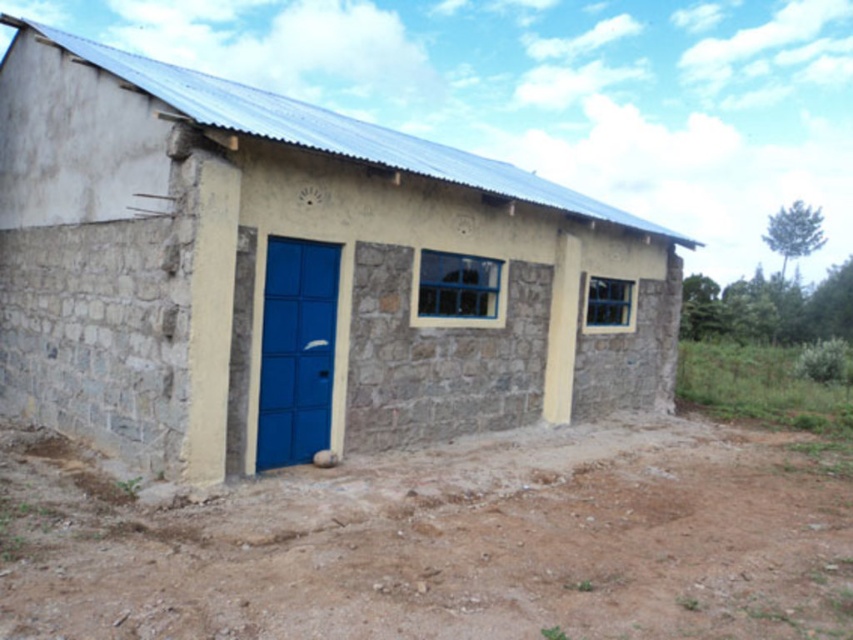
Question: Which object is closer to the camera taking this photo?

Choices:
 (A) smooth concrete hut at center
 (B) brown soil at lower center
 (C) matte blue door at center left

Answer: (B)

Question: Among these points, which one is nearest to the camera?

Choices:
 (A) (279, 336)
 (B) (616, 385)
 (C) (436, 627)

Answer: (C)

Question: Does brown soil at lower center have a greater width compared to matte blue door at center left?

Choices:
 (A) no
 (B) yes

Answer: (B)

Question: Does smooth concrete hut at center have a lesser width compared to brown soil at lower center?

Choices:
 (A) no
 (B) yes

Answer: (A)

Question: Is smooth concrete hut at center to the left of brown soil at lower center from the viewer's perspective?

Choices:
 (A) yes
 (B) no

Answer: (A)

Question: Which object is the closest to the brown soil at lower center?

Choices:
 (A) matte blue door at center left
 (B) smooth concrete hut at center

Answer: (A)